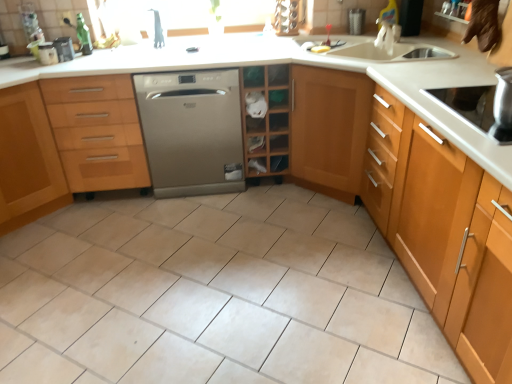
Question: Considering the relative sizes of black plastic container at upper left and satin silver dishwasher at center in the image provided, is black plastic container at upper left smaller than satin silver dishwasher at center?

Choices:
 (A) yes
 (B) no

Answer: (A)

Question: Considering the relative sizes of black plastic container at upper left and satin silver dishwasher at center in the image provided, is black plastic container at upper left taller than satin silver dishwasher at center?

Choices:
 (A) no
 (B) yes

Answer: (A)

Question: From the image's perspective, is black plastic container at upper left below satin silver dishwasher at center?

Choices:
 (A) yes
 (B) no

Answer: (B)

Question: From a real-world perspective, is black plastic container at upper left below satin silver dishwasher at center?

Choices:
 (A) no
 (B) yes

Answer: (A)

Question: Is black plastic container at upper left to the left of satin silver dishwasher at center from the viewer's perspective?

Choices:
 (A) yes
 (B) no

Answer: (A)

Question: Is black plastic container at upper left shorter than satin silver dishwasher at center?

Choices:
 (A) no
 (B) yes

Answer: (B)

Question: Considering the relative sizes of light brown wood cabinet at right, marked as the 1th cabinetry in a right-to-left arrangement, and wooden shelf at center in the image provided, is light brown wood cabinet at right, marked as the 1th cabinetry in a right-to-left arrangement, smaller than wooden shelf at center?

Choices:
 (A) no
 (B) yes

Answer: (A)

Question: Is light brown wood cabinet at right, marked as the 1th cabinetry in a right-to-left arrangement, to the left of wooden shelf at center from the viewer's perspective?

Choices:
 (A) no
 (B) yes

Answer: (A)

Question: From the image's perspective, is light brown wood cabinet at right, marked as the 1th cabinetry in a right-to-left arrangement, above wooden shelf at center?

Choices:
 (A) no
 (B) yes

Answer: (A)

Question: Can you confirm if light brown wood cabinet at right, marked as the 1th cabinetry in a right-to-left arrangement, is taller than wooden shelf at center?

Choices:
 (A) no
 (B) yes

Answer: (B)

Question: Is the depth of light brown wood cabinet at right, acting as the third cabinetry starting from the left, greater than that of wooden shelf at center?

Choices:
 (A) yes
 (B) no

Answer: (B)

Question: Is light brown wood cabinet at right, marked as the 1th cabinetry in a right-to-left arrangement, surrounding wooden shelf at center?

Choices:
 (A) no
 (B) yes

Answer: (A)

Question: From a real-world perspective, is wooden shelf at center physically above light brown wood cabinet at right, marked as the 1th cabinetry in a right-to-left arrangement?

Choices:
 (A) no
 (B) yes

Answer: (B)